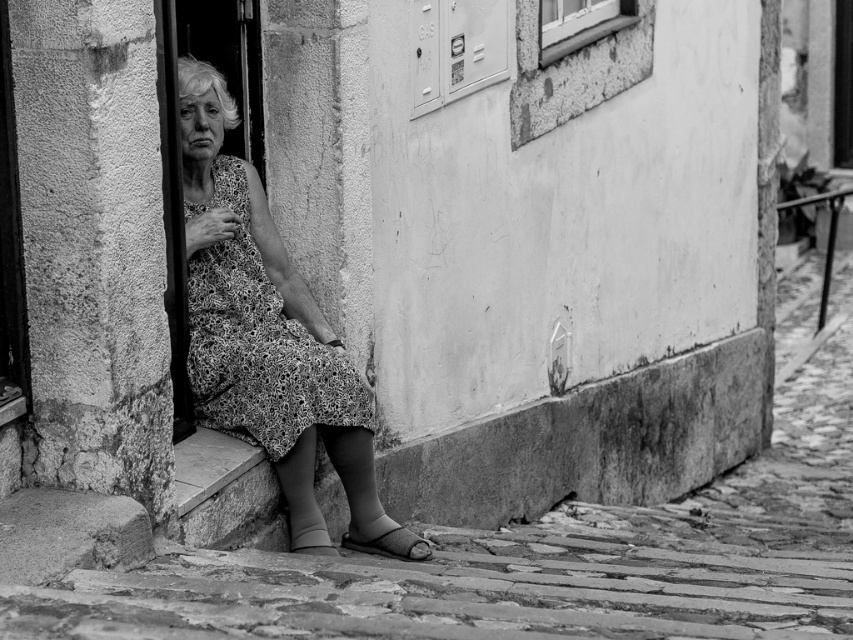
Is floral dress at left closer to camera compared to floral-patterned fabric dress at center?

No.

Who is taller, floral dress at left or floral-patterned fabric dress at center?

floral dress at left

Is point (306, 448) more distant than point (253, 365)?

That is True.

Where is `floral dress at left`? This screenshot has width=853, height=640. floral dress at left is located at coordinates (270, 337).